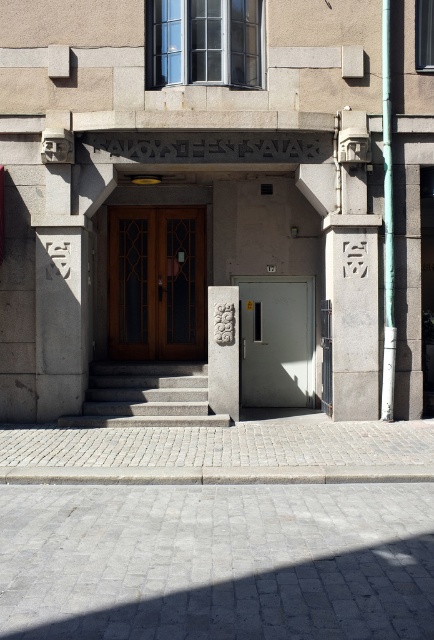
Is point (404, 538) positioned in front of point (124, 388)?

Yes.

Can you confirm if gray cobblestone pavement at lower center is taller than gray concrete stairs at center?

Incorrect, gray cobblestone pavement at lower center's height is not larger of gray concrete stairs at center's.

Is point (398, 554) closer to viewer compared to point (128, 396)?

That is True.

Locate an element on the screen. Image resolution: width=434 pixels, height=640 pixels. gray cobblestone pavement at lower center is located at coordinates (217, 561).

Is wooden glass-paneled door at center thinner than gray concrete stairs at center?

Yes.

Between wooden glass-paneled door at center and gray concrete stairs at center, which one is positioned higher?

wooden glass-paneled door at center

Who is more forward, (x=161, y=356) or (x=147, y=368)?

Point (x=147, y=368)

Locate an element on the screen. wooden glass-paneled door at center is located at coordinates (157, 284).

Between gray cobblestone pavement at lower center and gray metallic door at center, which one appears on the right side from the viewer's perspective?

gray metallic door at center is more to the right.

Does point (324, 593) come farther from viewer compared to point (249, 310)?

No.

Does point (232, 582) lie in front of point (279, 348)?

Yes, it is in front of point (279, 348).

Find the location of a particular element. The width and height of the screenshot is (434, 640). gray cobblestone pavement at lower center is located at coordinates pos(217,561).